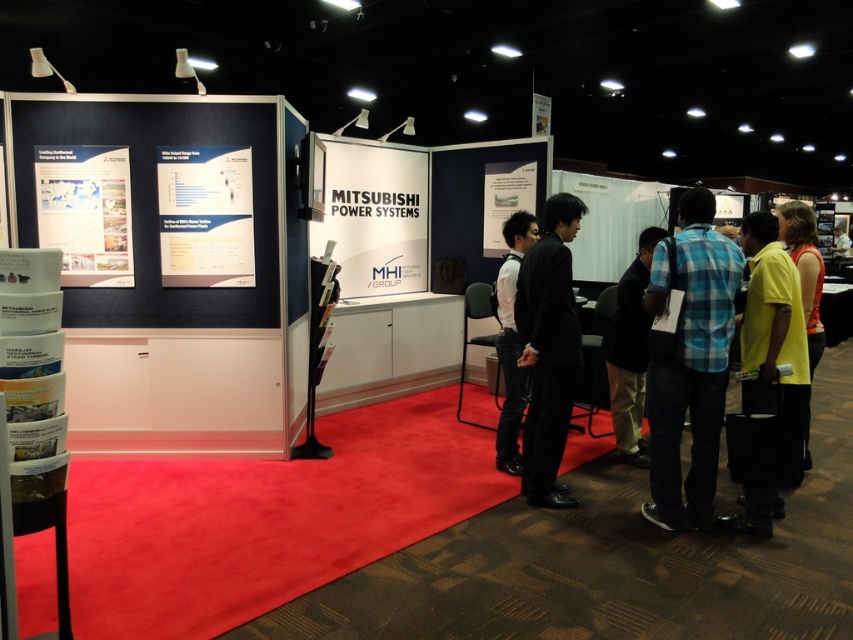
Question: Does white glossy poster at left have a larger size compared to white paper poster at upper left?

Choices:
 (A) no
 (B) yes

Answer: (A)

Question: Which point appears closest to the camera in this image?

Choices:
 (A) (509, 253)
 (B) (531, 97)
 (C) (570, 253)
 (D) (16, 451)

Answer: (D)

Question: Can you confirm if white paper poster at upper left is smaller than yellow fabric shirt at right?

Choices:
 (A) no
 (B) yes

Answer: (B)

Question: Which point appears farthest from the camera in this image?

Choices:
 (A) (497, 166)
 (B) (48, 440)

Answer: (A)

Question: Where is white paperboard at center located in relation to white glossy poster at left in the image?

Choices:
 (A) right
 (B) left

Answer: (A)

Question: Among these objects, which one is nearest to the camera?

Choices:
 (A) blue plaid shirt at right
 (B) white glossy poster at left

Answer: (B)